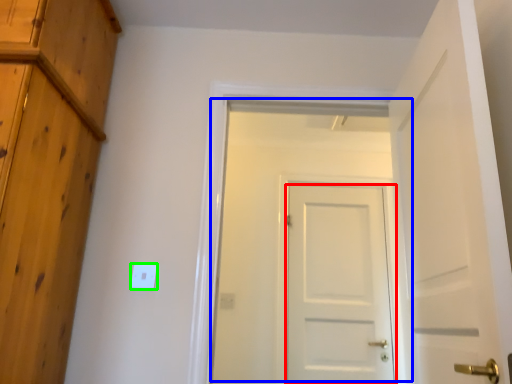
Question: Which object is the closest to the door (highlighted by a red box)? Choose among these: door (highlighted by a blue box) or light switch (highlighted by a green box).

Choices:
 (A) door
 (B) light switch

Answer: (A)